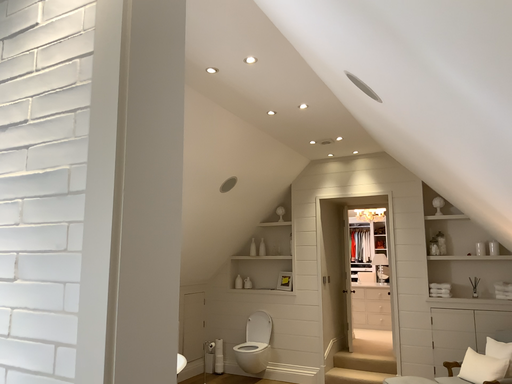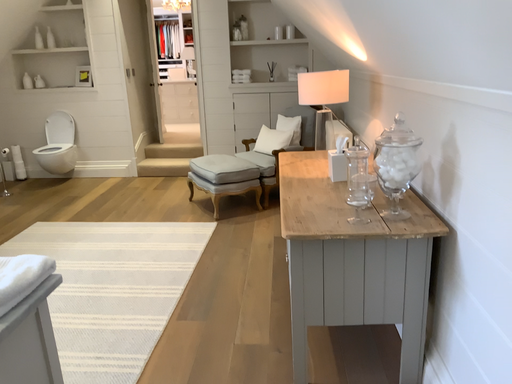
Question: Which way did the camera rotate in the video?

Choices:
 (A) rotated right
 (B) rotated left

Answer: (A)